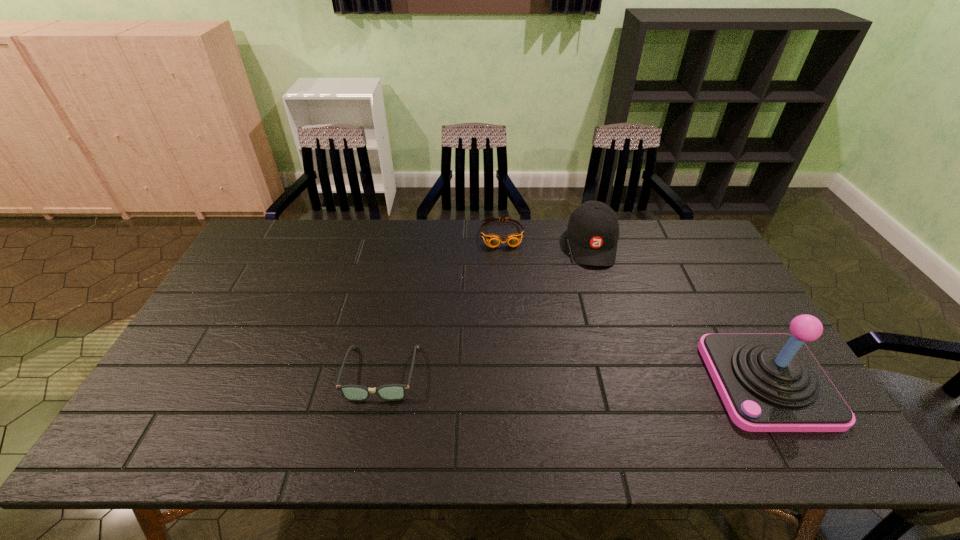
Where is `spectacles`? spectacles is located at coordinates (391, 392).

The image size is (960, 540). I want to click on the leftmost object, so click(391, 392).

Find the location of a particular element. the tallest object is located at coordinates (768, 382).

Find the location of `the rightmost object`. the rightmost object is located at coordinates (768, 382).

Where is `the second tallest object`? The width and height of the screenshot is (960, 540). the second tallest object is located at coordinates (593, 229).

Where is `the second object from right to left`? the second object from right to left is located at coordinates (593, 229).

This screenshot has width=960, height=540. I want to click on goggles, so click(493, 240).

At what (x,y) coordinates should I click in order to perform the action: click on the shortest object. Please return your answer as a coordinate pair (x, y). The width and height of the screenshot is (960, 540). Looking at the image, I should click on (493, 240).

The height and width of the screenshot is (540, 960). What are the coordinates of `vacant space located forward from the base of the tallest object` in the screenshot? It's located at (614, 382).

The image size is (960, 540). I want to click on free location located forward from the base of the tallest object, so click(583, 382).